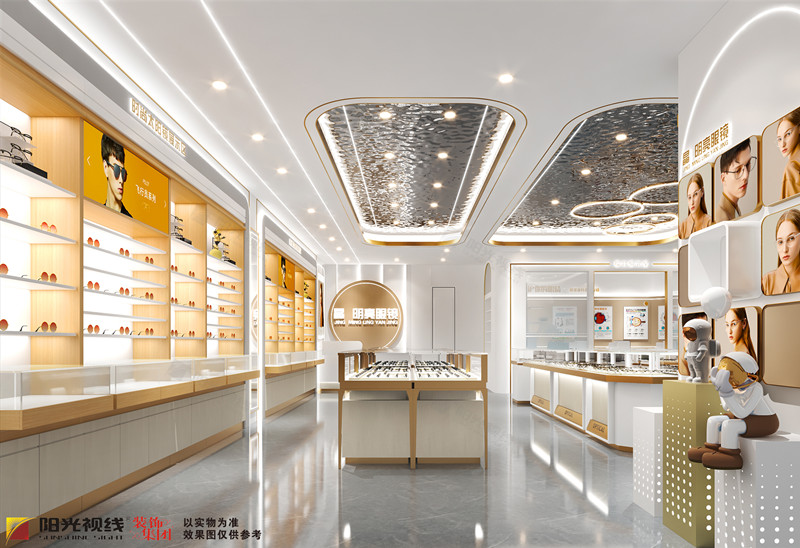
I want to click on reflective section of ceiling, so click(x=410, y=174), click(x=620, y=173).